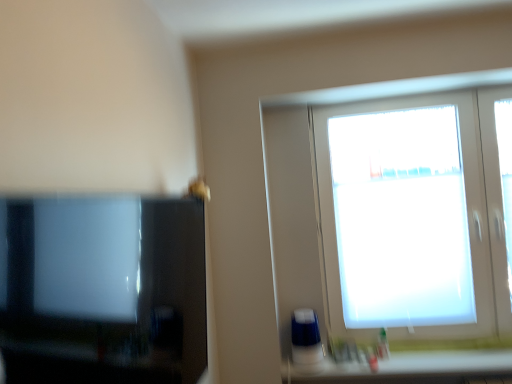
I want to click on empty space that is ontop of white matte window at upper right, so click(412, 94).